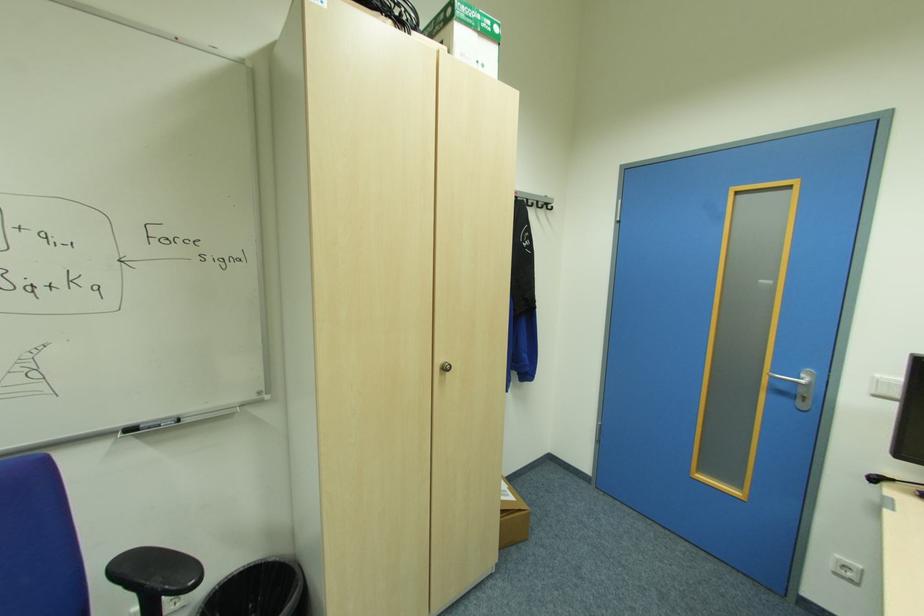
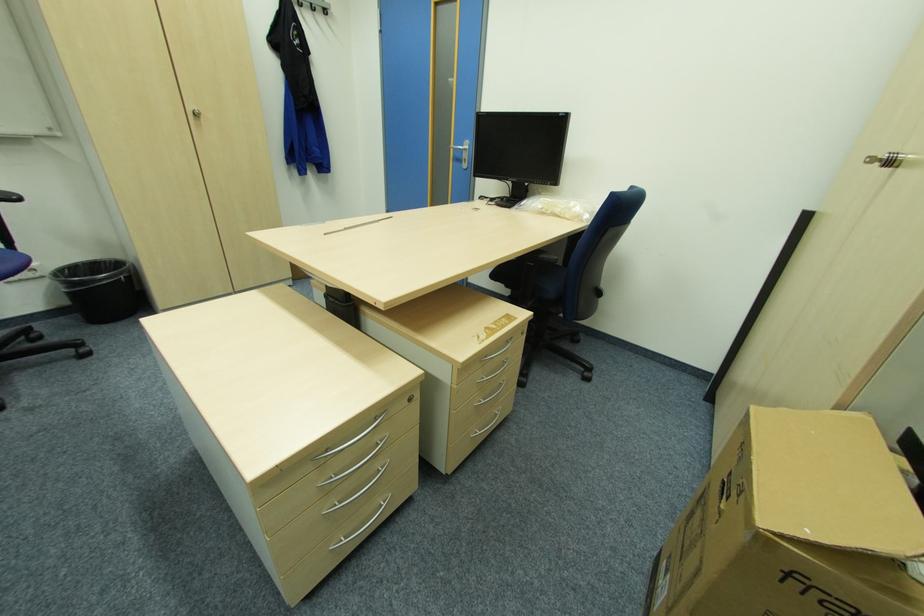
The images are taken continuously from a first-person perspective. In which direction are you moving?

The cameraman moved toward right, backward.